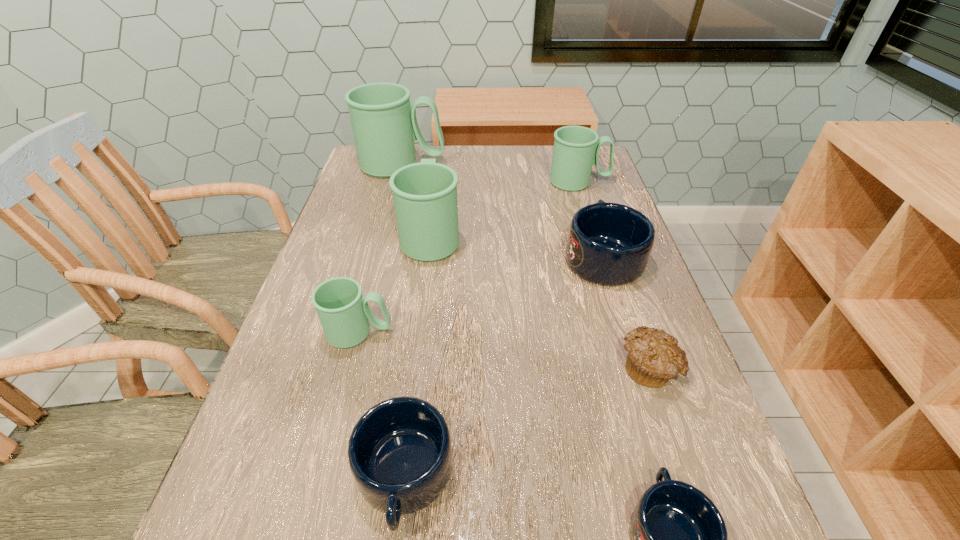
Where is `the tallest mug`? Image resolution: width=960 pixels, height=540 pixels. the tallest mug is located at coordinates (384, 123).

This screenshot has width=960, height=540. Identify the location of the biggest green mug. (384, 123).

At what (x,y) coordinates should I click in order to perform the action: click on the sixth shortest mug. Please return your answer as a coordinate pair (x, y). Looking at the image, I should click on (425, 194).

This screenshot has height=540, width=960. What are the coordinates of `the second biggest green mug` in the screenshot? It's located at (425, 194).

The height and width of the screenshot is (540, 960). Find the location of `the rightmost green mug`. the rightmost green mug is located at coordinates (576, 148).

Locate an element on the screen. the sixth shortest object is located at coordinates click(576, 148).

Where is `the biggest blue mug`? Image resolution: width=960 pixels, height=540 pixels. the biggest blue mug is located at coordinates (609, 244).

Find the location of `the smallest green mug`. the smallest green mug is located at coordinates (343, 312).

Locate an element on the screen. the fifth farthest mug is located at coordinates (343, 312).

Identify the location of muffin. (654, 358).